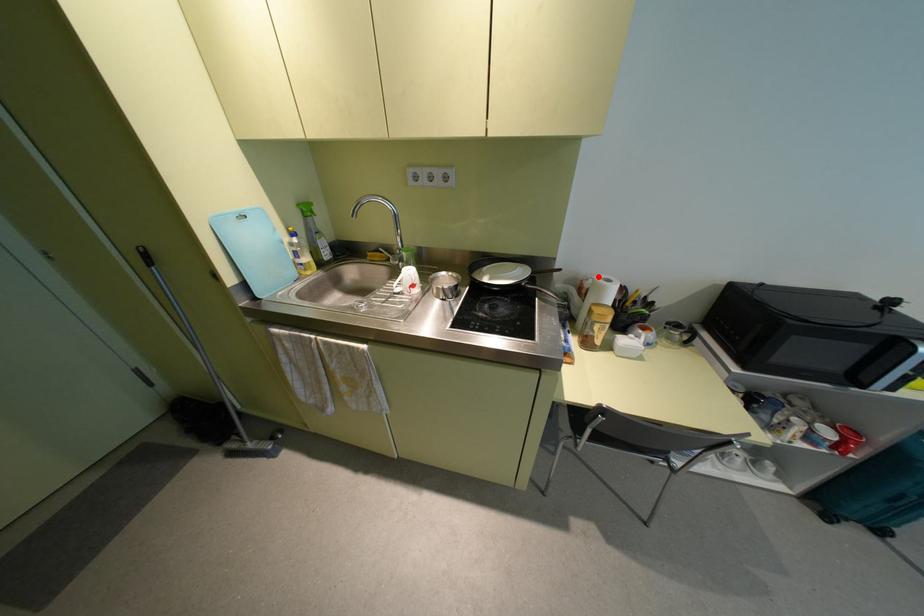
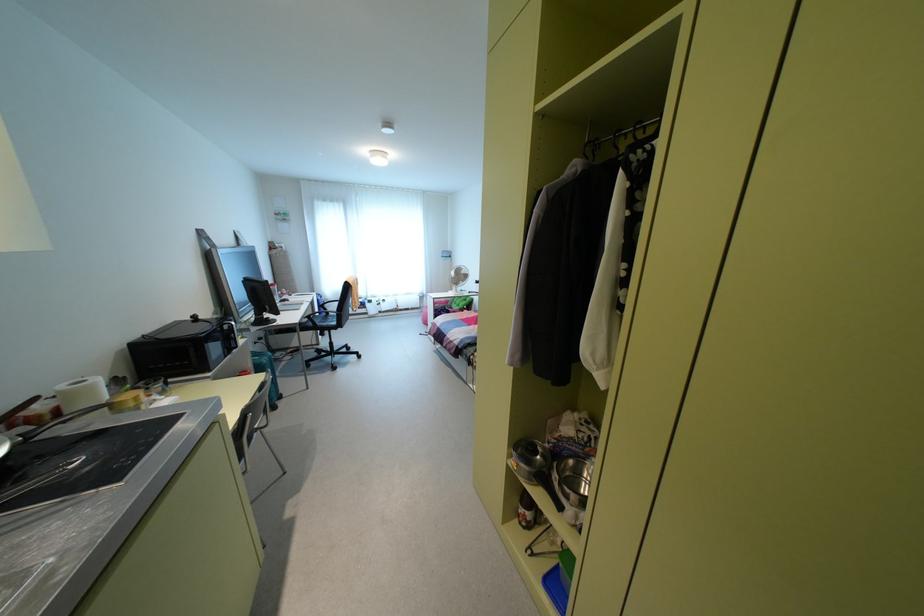
Question: I am providing you with two images of the same scene from different viewpoints. In image1, a red point is highlighted. Considering the same 3D point in image2, which of the following is correct?

Choices:
 (A) It is closer
 (B) It is farther

Answer: (B)